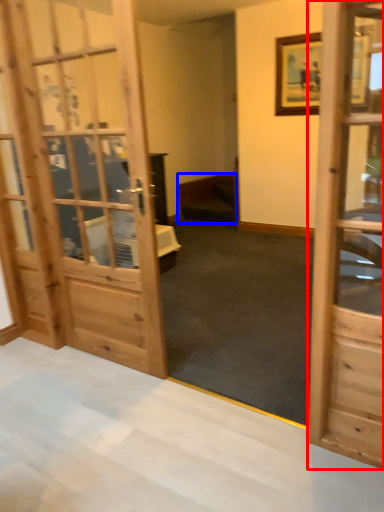
Question: Which object is further to the camera taking this photo, door (highlighted by a red box) or furniture (highlighted by a blue box)?

Choices:
 (A) door
 (B) furniture

Answer: (B)